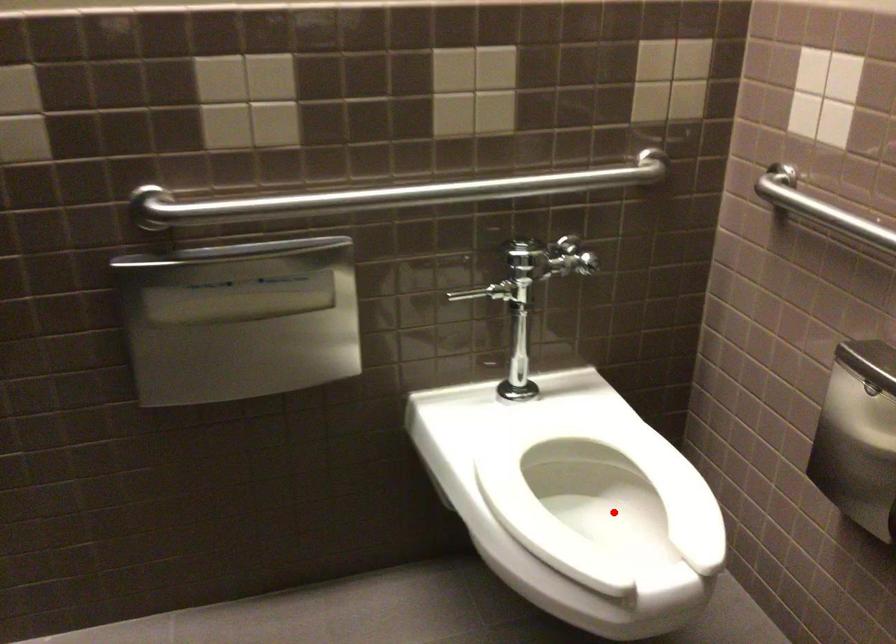
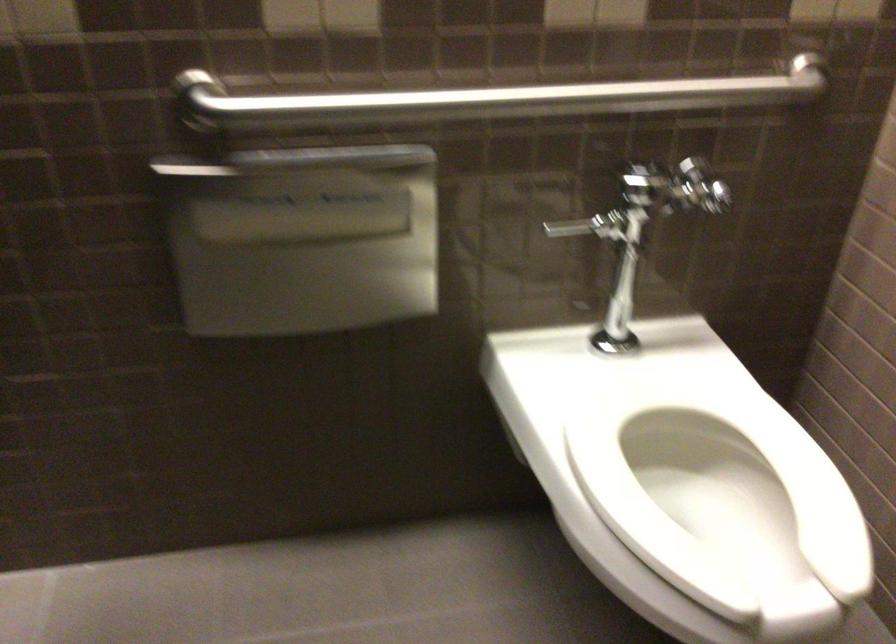
Question: I am providing you with two images of the same scene from different viewpoints. A red point is shown in image1. For the corresponding object point in image2, is it positioned nearer or farther from the camera?

Choices:
 (A) Nearer
 (B) Farther

Answer: (A)